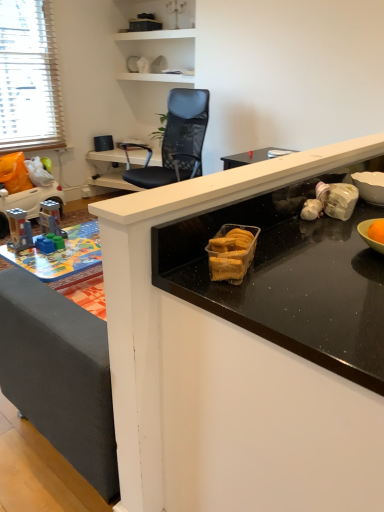
Question: Is black mesh chair at upper center far away from black mesh chair at upper center?

Choices:
 (A) yes
 (B) no

Answer: (B)

Question: Considering the relative sizes of black mesh chair at upper center and black mesh chair at upper center in the image provided, is black mesh chair at upper center taller than black mesh chair at upper center?

Choices:
 (A) no
 (B) yes

Answer: (A)

Question: Considering the relative sizes of black mesh chair at upper center and black mesh chair at upper center in the image provided, is black mesh chair at upper center wider than black mesh chair at upper center?

Choices:
 (A) yes
 (B) no

Answer: (A)

Question: Is black mesh chair at upper center outside of black mesh chair at upper center?

Choices:
 (A) no
 (B) yes

Answer: (B)

Question: Considering the relative positions of black mesh chair at upper center and black mesh chair at upper center in the image provided, is black mesh chair at upper center to the left of black mesh chair at upper center from the viewer's perspective?

Choices:
 (A) yes
 (B) no

Answer: (A)

Question: In the image, is black mesh chair at upper center positioned in front of or behind plastic toy car at left, positioned as the second toy in front-to-back order?

Choices:
 (A) behind
 (B) front

Answer: (B)

Question: Does point (147, 184) appear closer or farther from the camera than point (61, 195)?

Choices:
 (A) farther
 (B) closer

Answer: (B)

Question: Considering the positions of black mesh chair at upper center and plastic toy car at left, the second toy when ordered from right to left, in the image, is black mesh chair at upper center taller or shorter than plastic toy car at left, the second toy when ordered from right to left,?

Choices:
 (A) tall
 (B) short

Answer: (A)

Question: Looking at their shapes, would you say black mesh chair at upper center is wider or thinner than plastic toy car at left, the second toy when ordered from right to left?

Choices:
 (A) wide
 (B) thin

Answer: (A)

Question: Looking at the image, does black mesh chair at upper center seem bigger or smaller compared to black mesh chair at upper center?

Choices:
 (A) small
 (B) big

Answer: (B)

Question: From a real-world perspective, is black mesh chair at upper center physically located above or below black mesh chair at upper center?

Choices:
 (A) below
 (B) above

Answer: (B)

Question: From the image's perspective, is black mesh chair at upper center positioned above or below black mesh chair at upper center?

Choices:
 (A) above
 (B) below

Answer: (B)

Question: Is black mesh chair at upper center in front of or behind black mesh chair at upper center in the image?

Choices:
 (A) behind
 (B) front

Answer: (B)

Question: Is point coord(104,174) positioned closer to the camera than point coord(24,172)?

Choices:
 (A) closer
 (B) farther

Answer: (B)

Question: In terms of width, does black mesh chair at upper center look wider or thinner when compared to plastic toy car at left, the second toy when ordered from right to left?

Choices:
 (A) wide
 (B) thin

Answer: (A)